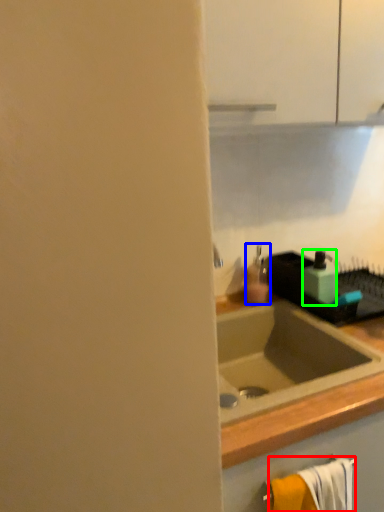
Question: Considering the real-world distances, which object is farthest from bath towel (highlighted by a red box)? soap dispenser (highlighted by a blue box) or soap dispenser (highlighted by a green box)?

Choices:
 (A) soap dispenser
 (B) soap dispenser

Answer: (A)